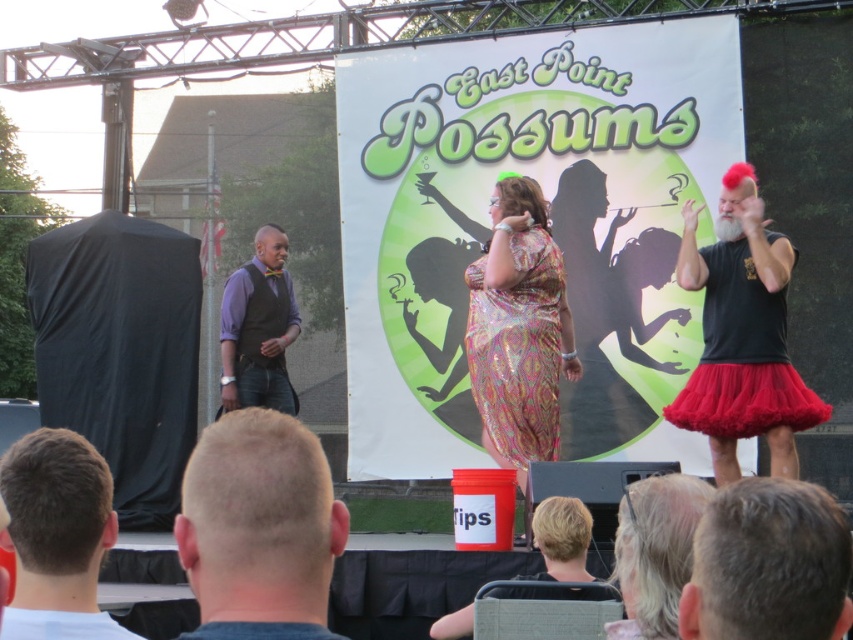
Based on the scene description, what are the coordinates of the matte black tutu at right?

The coordinates of the matte black tutu at right are at point (741, 333).